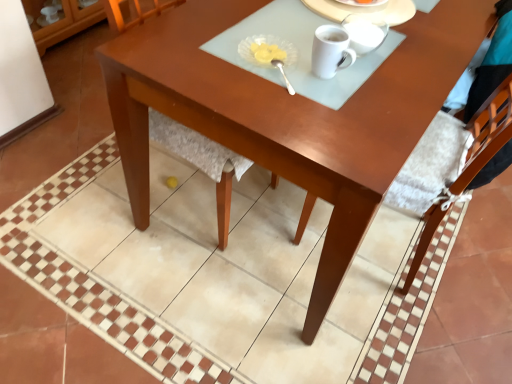
Where is `free spot to the left of translucent glass dish at upper center, positioned as the third tableware in top-to-bottom order`? This screenshot has width=512, height=384. free spot to the left of translucent glass dish at upper center, positioned as the third tableware in top-to-bottom order is located at coordinates (197, 48).